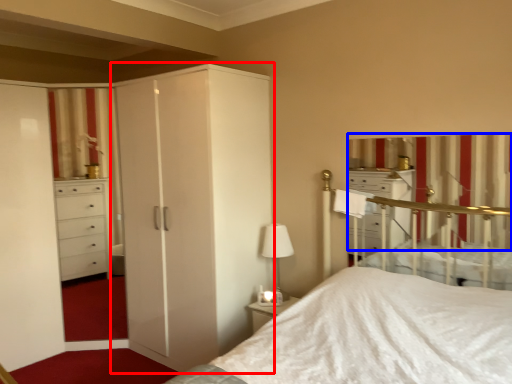
Question: Which point is closer to the camera, cupboard (highlighted by a red box) or curtain (highlighted by a blue box)?

Choices:
 (A) cupboard
 (B) curtain

Answer: (B)